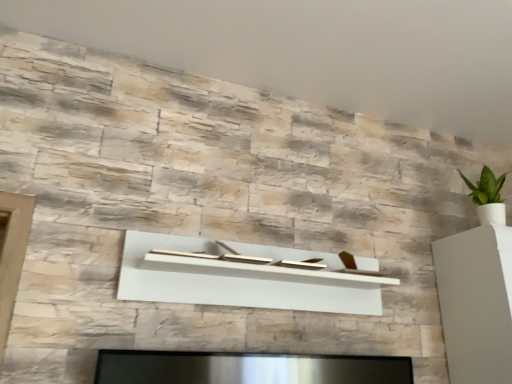
In order to face white glossy vase at right, should I rotate leftwards or rightwards?

Turn right approximately 31.435 degrees to face it.

What is the approximate width of natural stone wall at upper center?

natural stone wall at upper center is 2.54 meters wide.

Locate an element on the screen. The height and width of the screenshot is (384, 512). white glossy vase at right is located at coordinates (476, 303).

Is natural stone wall at upper center in front of white glossy vase at right?

Yes, it is in front of white glossy vase at right.

Would you consider natural stone wall at upper center to be distant from white glossy vase at right?

natural stone wall at upper center is actually quite close to white glossy vase at right.

From the image's perspective, is natural stone wall at upper center under white glossy vase at right?

Actually, natural stone wall at upper center appears above white glossy vase at right in the image.

Which of these two, white glossy vase at right or white matte shelf at center, stands shorter?

white matte shelf at center is shorter.

Does white glossy vase at right have a greater width compared to white matte shelf at center?

Yes.

Considering the relative sizes of white glossy vase at right and white matte shelf at center in the image provided, is white glossy vase at right bigger than white matte shelf at center?

Yes.

How different are the orientations of white glossy vase at right and white matte shelf at center in degrees?

white glossy vase at right and white matte shelf at center are facing 1.22 degrees away from each other.

Locate an element on the screen. shelf lying in front of the white glossy vase at right is located at coordinates (241, 278).

Is white matte shelf at center not close to white glossy vase at right?

white matte shelf at center is actually quite close to white glossy vase at right.

Is white matte shelf at center further to camera compared to white glossy vase at right?

No, it is in front of white glossy vase at right.

Locate an element on the screen. Image resolution: width=512 pixels, height=384 pixels. furniture that appears on the right of natural stone wall at upper center is located at coordinates (476, 303).

Is white glossy vase at right behind natural stone wall at upper center?

Yes, it is.

Is white glossy vase at right located outside natural stone wall at upper center?

Yes, white glossy vase at right is outside of natural stone wall at upper center.

Choose the correct answer: Is white matte shelf at center inside natural stone wall at upper center or outside it?

white matte shelf at center cannot be found inside natural stone wall at upper center.

Does white matte shelf at center come behind natural stone wall at upper center?

Yes, it is.

From a real-world perspective, is white matte shelf at center physically below natural stone wall at upper center?

Correct, in the physical world, white matte shelf at center is lower than natural stone wall at upper center.

Is white matte shelf at center with natural stone wall at upper center?

No, white matte shelf at center is not in contact with natural stone wall at upper center.

Are natural stone wall at upper center and white matte shelf at center beside each other?

natural stone wall at upper center is not next to white matte shelf at center, and they're not touching.

How different are the orientations of natural stone wall at upper center and white matte shelf at center in degrees?

90.5 degrees separate the facing orientations of natural stone wall at upper center and white matte shelf at center.

Considering the sizes of natural stone wall at upper center and white matte shelf at center in the image, is natural stone wall at upper center taller or shorter than white matte shelf at center?

Clearly, natural stone wall at upper center is shorter compared to white matte shelf at center.

Considering the sizes of objects natural stone wall at upper center and white matte shelf at center in the image provided, who is thinner, natural stone wall at upper center or white matte shelf at center?

white matte shelf at center is thinner.

Image resolution: width=512 pixels, height=384 pixels. I want to click on backdrop on the left of the white glossy vase at right, so click(x=316, y=51).

At what (x,y) coordinates should I click in order to perform the action: click on shelf that appears in front of the white glossy vase at right. Please return your answer as a coordinate pair (x, y). The width and height of the screenshot is (512, 384). Looking at the image, I should click on (241, 278).

Which object lies nearer to the anchor point white glossy vase at right, natural stone wall at upper center or white matte shelf at center?

Among the two, white matte shelf at center is located nearer to white glossy vase at right.

Which object lies nearer to the anchor point white matte shelf at center, white glossy vase at right or natural stone wall at upper center?

white glossy vase at right is closer to white matte shelf at center.

Based on their spatial positions, is white matte shelf at center or white glossy vase at right further from natural stone wall at upper center?

Based on the image, white glossy vase at right appears to be further to natural stone wall at upper center.

From the image, which object appears to be nearer to white matte shelf at center, natural stone wall at upper center or white glossy vase at right?

Based on the image, white glossy vase at right appears to be nearer to white matte shelf at center.

When comparing their distances from white glossy vase at right, does white matte shelf at center or natural stone wall at upper center seem further?

natural stone wall at upper center is further to white glossy vase at right.

Which object lies nearer to the anchor point natural stone wall at upper center, white glossy vase at right or white matte shelf at center?

white matte shelf at center.

This screenshot has width=512, height=384. I want to click on shelf between natural stone wall at upper center and white glossy vase at right from top to bottom, so click(x=241, y=278).